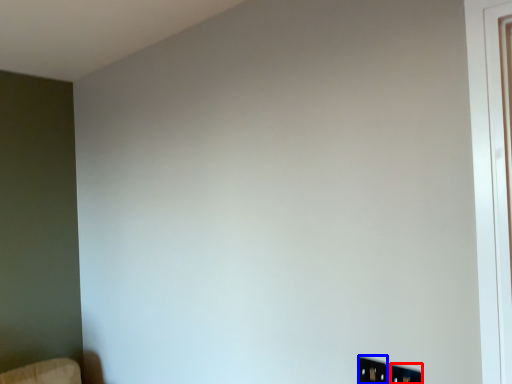
Question: Among these objects, which one is farthest to the camera, electric outlet (highlighted by a red box) or electric outlet (highlighted by a blue box)?

Choices:
 (A) electric outlet
 (B) electric outlet

Answer: (B)